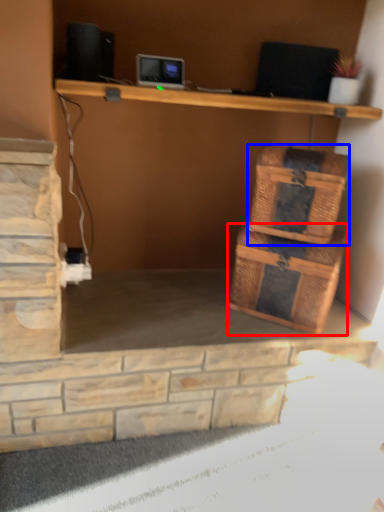
Question: Which point is closer to the camera, storage box (highlighted by a red box) or basket (highlighted by a blue box)?

Choices:
 (A) storage box
 (B) basket

Answer: (B)